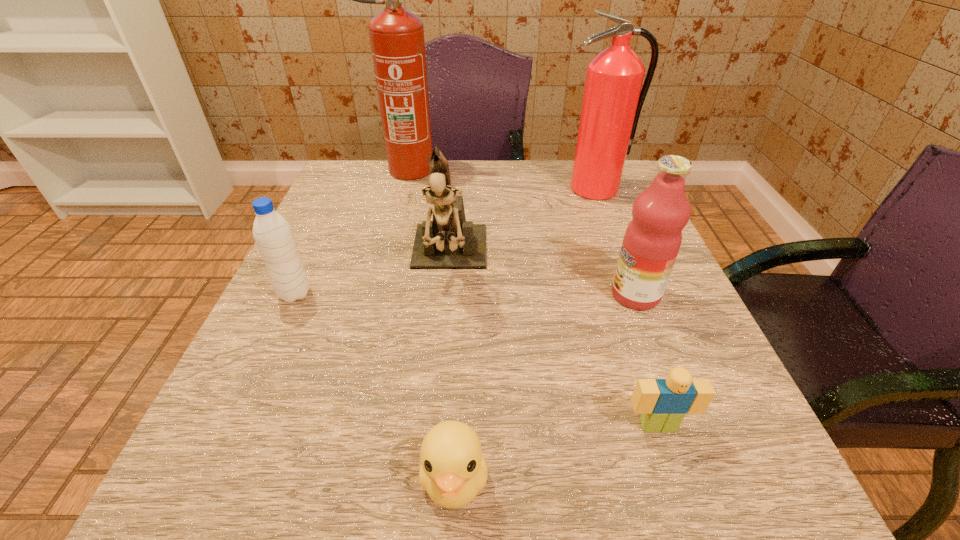
At what (x,y) coordinates should I click in order to perform the action: click on free space that is in between the nearest object and the fruit juice. Please return your answer as a coordinate pair (x, y). This screenshot has width=960, height=540. Looking at the image, I should click on (x=545, y=387).

Choose which object is the second nearest neighbor to the second tallest object. Please provide its 2D coordinates. Your answer should be formatted as a tuple, i.e. [(x, y)], where the tuple contains the x and y coordinates of a point satisfying the conditions above.

[(652, 240)]

Identify the location of the sixth closest object to the figurine. (663, 403).

Where is `vacant space that satisfies the following two spatial constraints: 1. on the label of the fruit juice; 2. on the face of the sixth farthest object`? vacant space that satisfies the following two spatial constraints: 1. on the label of the fruit juice; 2. on the face of the sixth farthest object is located at coordinates (685, 426).

The width and height of the screenshot is (960, 540). I want to click on free region that satisfies the following two spatial constraints: 1. on the label of the fruit juice; 2. on the face of the Lego, so click(x=685, y=426).